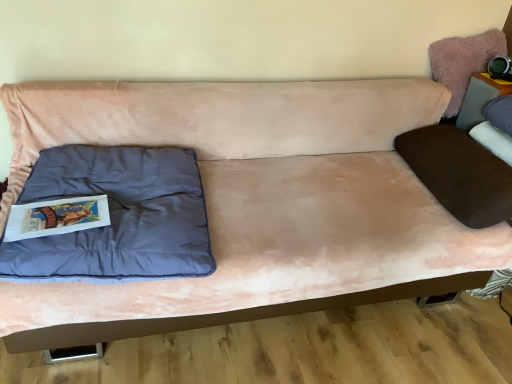
Question: Is fuzzy pink pillow at upper right smaller than matte gray table at upper right?

Choices:
 (A) no
 (B) yes

Answer: (A)

Question: Is fuzzy pink pillow at upper right wider than matte gray table at upper right?

Choices:
 (A) no
 (B) yes

Answer: (B)

Question: Does fuzzy pink pillow at upper right have a lesser width compared to matte gray table at upper right?

Choices:
 (A) yes
 (B) no

Answer: (B)

Question: Does fuzzy pink pillow at upper right have a lesser height compared to matte gray table at upper right?

Choices:
 (A) yes
 (B) no

Answer: (A)

Question: Can you confirm if fuzzy pink pillow at upper right is taller than matte gray table at upper right?

Choices:
 (A) no
 (B) yes

Answer: (A)

Question: From the image's perspective, is fuzzy pink pillow at upper right beneath matte gray table at upper right?

Choices:
 (A) yes
 (B) no

Answer: (B)

Question: Are matte blue pillow at left and pink suede couch at center located far from each other?

Choices:
 (A) yes
 (B) no

Answer: (B)

Question: Is matte blue pillow at left turned away from pink suede couch at center?

Choices:
 (A) yes
 (B) no

Answer: (A)

Question: Is matte blue pillow at left in front of pink suede couch at center?

Choices:
 (A) no
 (B) yes

Answer: (A)

Question: Can you confirm if matte blue pillow at left is shorter than pink suede couch at center?

Choices:
 (A) no
 (B) yes

Answer: (B)

Question: Does matte blue pillow at left have a larger size compared to pink suede couch at center?

Choices:
 (A) no
 (B) yes

Answer: (A)

Question: Considering the relative sizes of matte blue pillow at left and pink suede couch at center in the image provided, is matte blue pillow at left smaller than pink suede couch at center?

Choices:
 (A) yes
 (B) no

Answer: (A)

Question: Can we say matte blue pillow at left lies outside matte gray table at upper right?

Choices:
 (A) no
 (B) yes

Answer: (B)